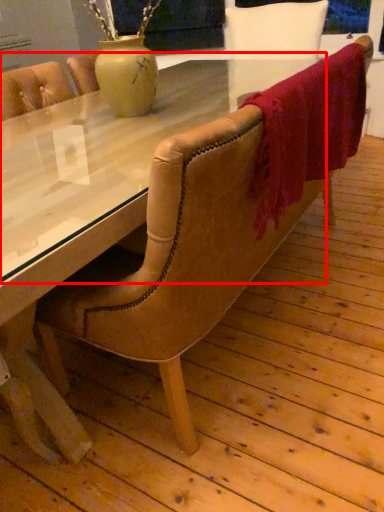
Question: From the image, what is the correct spatial relationship of glass table (annotated by the red box) in relation to blanket?

Choices:
 (A) left
 (B) right

Answer: (A)